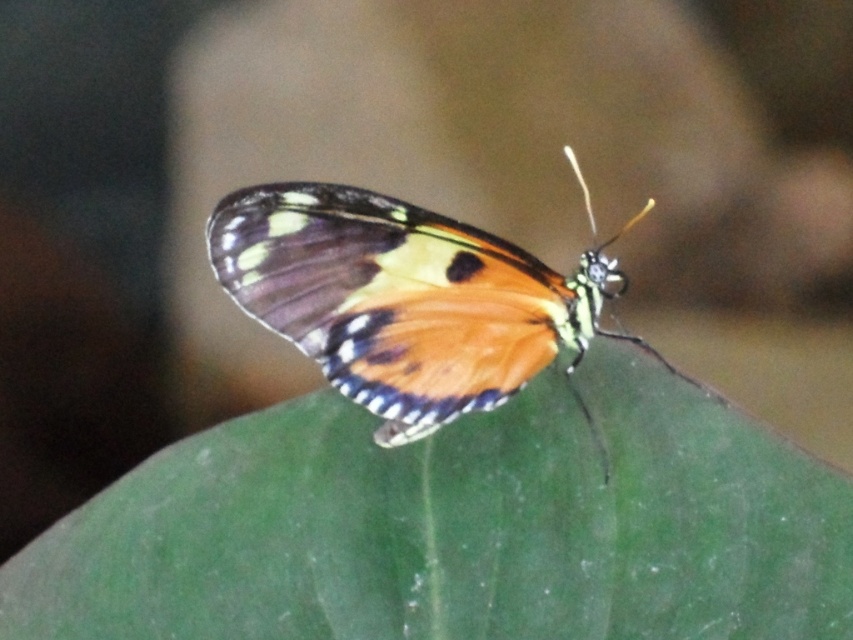
Is green matte leaf at center above shiny orange butterfly at center?

Actually, green matte leaf at center is below shiny orange butterfly at center.

Based on the photo, does green matte leaf at center appear on the right side of shiny orange butterfly at center?

No, green matte leaf at center is not to the right of shiny orange butterfly at center.

Is point (488, 426) behind point (521, 358)?

That is True.

Find the location of a particular element. The image size is (853, 640). green matte leaf at center is located at coordinates (457, 525).